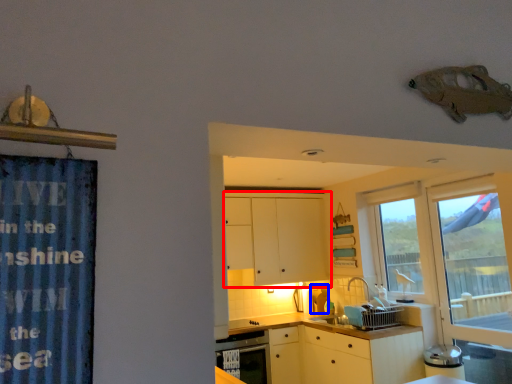
Question: Which object appears closest to the camera in this image, cabinetry (highlighted by a red box) or appliance (highlighted by a blue box)?

Choices:
 (A) cabinetry
 (B) appliance

Answer: (A)